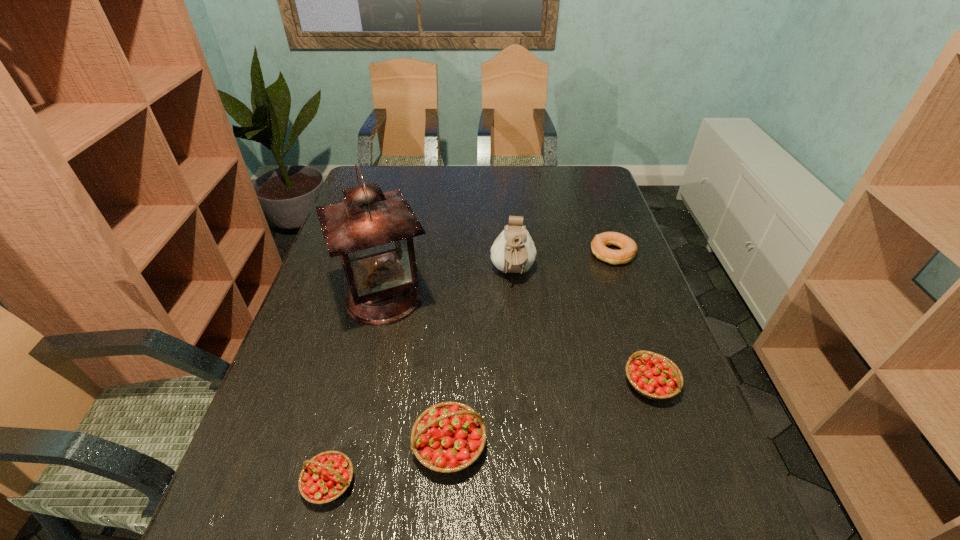
Where is `the second shortest object`? the second shortest object is located at coordinates (325, 477).

Locate an element on the screen. The width and height of the screenshot is (960, 540). the shortest strawberry is located at coordinates (325, 477).

Locate an element on the screen. This screenshot has height=540, width=960. the tallest strawberry is located at coordinates (447, 437).

The image size is (960, 540). Identify the location of the second strawberry from right to left. (447, 437).

Find the location of `the third nearest object`. the third nearest object is located at coordinates (652, 375).

Locate an element on the screen. The width and height of the screenshot is (960, 540). the second shortest strawberry is located at coordinates (652, 375).

The width and height of the screenshot is (960, 540). I want to click on bagel, so click(628, 247).

Identify the location of the tallest object. [372, 231].

I want to click on the fourth object from left to right, so click(x=513, y=251).

What are the coordinates of `the second tallest object` in the screenshot? It's located at (513, 251).